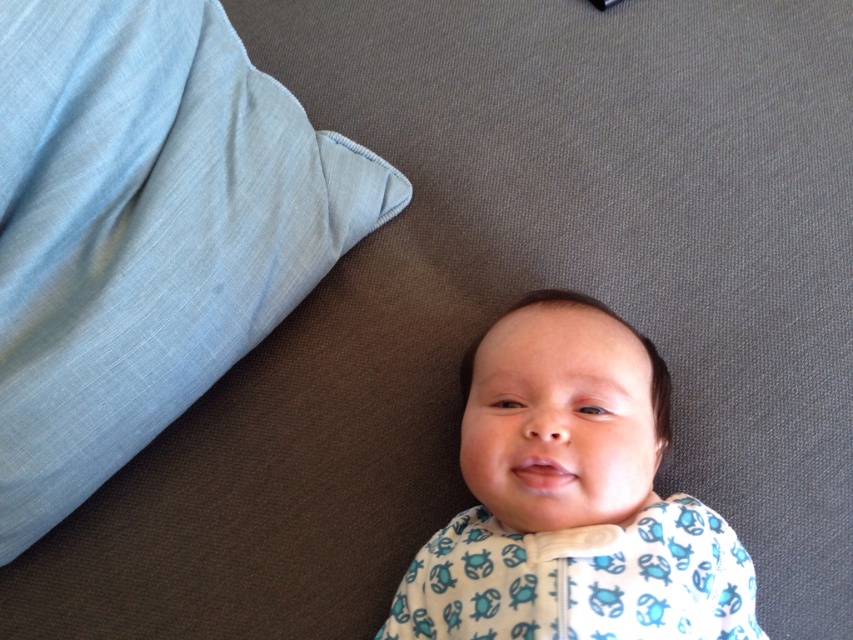
You are a photographer setting up for a baby photo shoot. You see the light blue fabric at upper left and the white soft fabric baby at center. Which object is located to the left of the other?

The light blue fabric at upper left is positioned on the left side of white soft fabric baby at center.

You are a photographer setting up for a baby photoshoot. You see the light blue fabric at upper left and the white soft fabric baby at center. Which object is positioned higher in the image?

The light blue fabric at upper left is located above the white soft fabric baby at center, so it is positioned higher in the image.

You are a photographer setting up for a baby photoshoot. You have a light blue fabric at upper left and a white soft fabric baby at center in your frame. Which object occupies more space in the current composition?

The light blue fabric at upper left is bigger than the white soft fabric baby at center, so it occupies more space in the current composition.